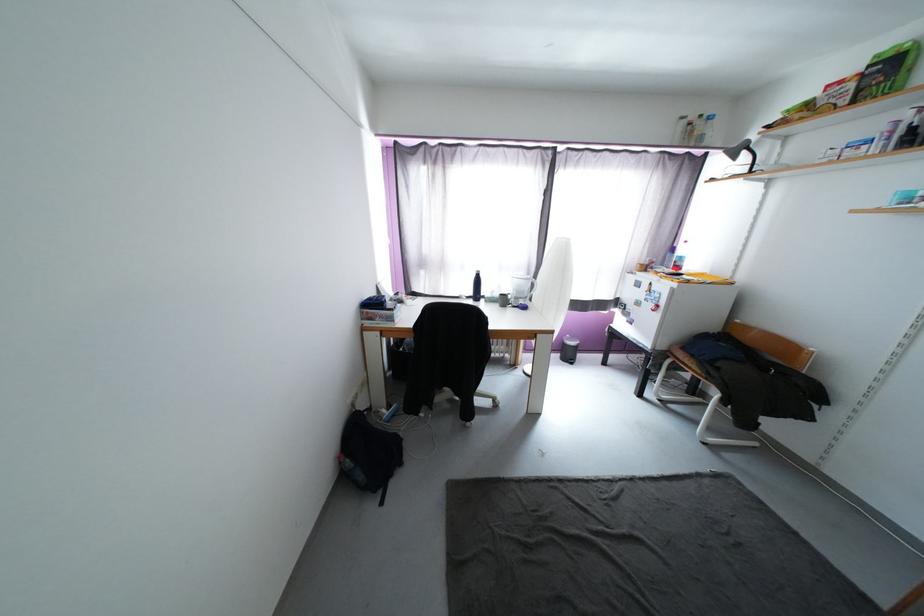
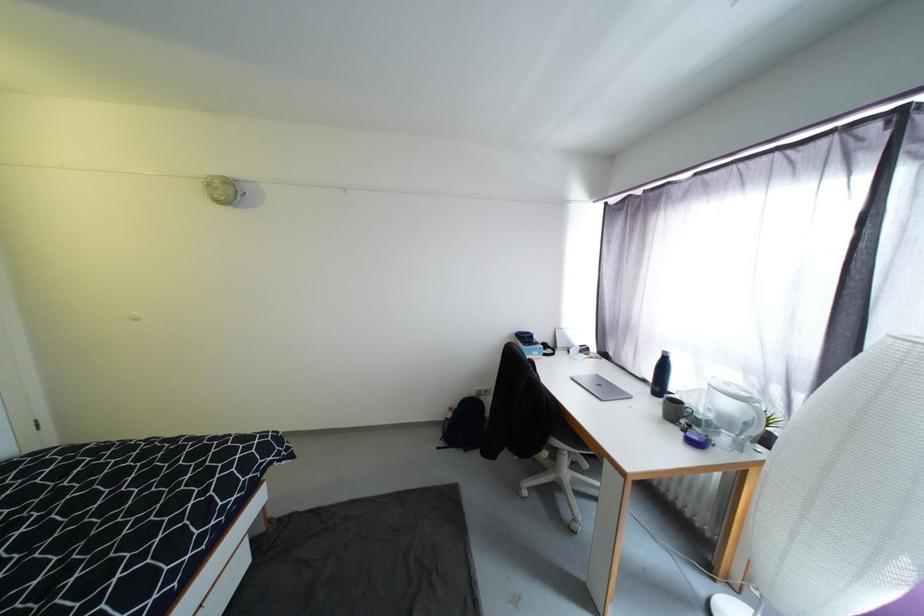
Where in the second image is the point corresponding to point (480, 277) from the first image?

(665, 358)